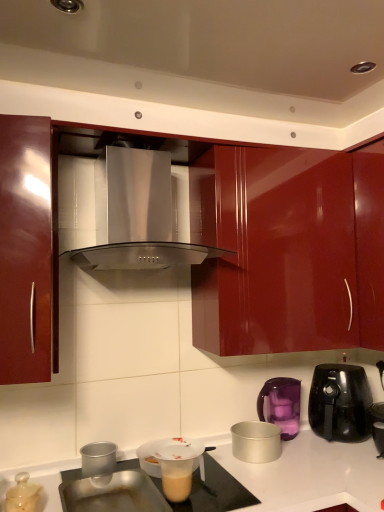
Question: Is purple plastic kettle at right, positioned as the second kitchen appliance in right-to-left order, further to camera compared to translucent plastic lid at lower left, marked as the 5th kitchen appliance in a right-to-left arrangement?

Choices:
 (A) yes
 (B) no

Answer: (A)

Question: Does purple plastic kettle at right, which is the fourth kitchen appliance from left to right, have a greater height compared to translucent plastic lid at lower left, marked as the 1th kitchen appliance in a left-to-right arrangement?

Choices:
 (A) no
 (B) yes

Answer: (B)

Question: Can you confirm if purple plastic kettle at right, positioned as the second kitchen appliance in right-to-left order, is smaller than translucent plastic lid at lower left, marked as the 5th kitchen appliance in a right-to-left arrangement?

Choices:
 (A) no
 (B) yes

Answer: (A)

Question: Would you consider purple plastic kettle at right, positioned as the second kitchen appliance in right-to-left order, to be distant from translucent plastic lid at lower left, marked as the 1th kitchen appliance in a left-to-right arrangement?

Choices:
 (A) no
 (B) yes

Answer: (B)

Question: Is purple plastic kettle at right, positioned as the second kitchen appliance in right-to-left order, facing towards translucent plastic lid at lower left, marked as the 5th kitchen appliance in a right-to-left arrangement?

Choices:
 (A) no
 (B) yes

Answer: (A)

Question: In terms of size, does translucent plastic cup at lower center appear bigger or smaller than purple plastic kettle at right, which is the fourth kitchen appliance from left to right?

Choices:
 (A) small
 (B) big

Answer: (A)

Question: From their relative heights in the image, would you say translucent plastic cup at lower center is taller or shorter than purple plastic kettle at right, positioned as the second kitchen appliance in right-to-left order?

Choices:
 (A) tall
 (B) short

Answer: (B)

Question: From the image's perspective, relative to purple plastic kettle at right, which is the fourth kitchen appliance from left to right, is translucent plastic cup at lower center above or below?

Choices:
 (A) below
 (B) above

Answer: (A)

Question: Is point (185, 479) positioned closer to the camera than point (284, 409)?

Choices:
 (A) closer
 (B) farther

Answer: (A)

Question: From the image's perspective, is glossy red cabinet at left above or below translucent plastic lid at lower left, marked as the 1th kitchen appliance in a left-to-right arrangement?

Choices:
 (A) below
 (B) above

Answer: (B)

Question: From a real-world perspective, relative to translucent plastic lid at lower left, marked as the 1th kitchen appliance in a left-to-right arrangement, is glossy red cabinet at left vertically above or below?

Choices:
 (A) above
 (B) below

Answer: (A)

Question: Considering the positions of point (289, 158) and point (14, 477), is point (289, 158) closer or farther from the camera than point (14, 477)?

Choices:
 (A) closer
 (B) farther

Answer: (B)

Question: Considering the positions of glossy red cabinet at left and translucent plastic lid at lower left, marked as the 1th kitchen appliance in a left-to-right arrangement, in the image, is glossy red cabinet at left taller or shorter than translucent plastic lid at lower left, marked as the 1th kitchen appliance in a left-to-right arrangement,?

Choices:
 (A) short
 (B) tall

Answer: (B)

Question: Would you say purple plastic kettle at right, positioned as the second kitchen appliance in right-to-left order, is inside or outside glossy red cabinet at left?

Choices:
 (A) outside
 (B) inside

Answer: (A)

Question: Looking at their shapes, would you say purple plastic kettle at right, positioned as the second kitchen appliance in right-to-left order, is wider or thinner than glossy red cabinet at left?

Choices:
 (A) wide
 (B) thin

Answer: (B)